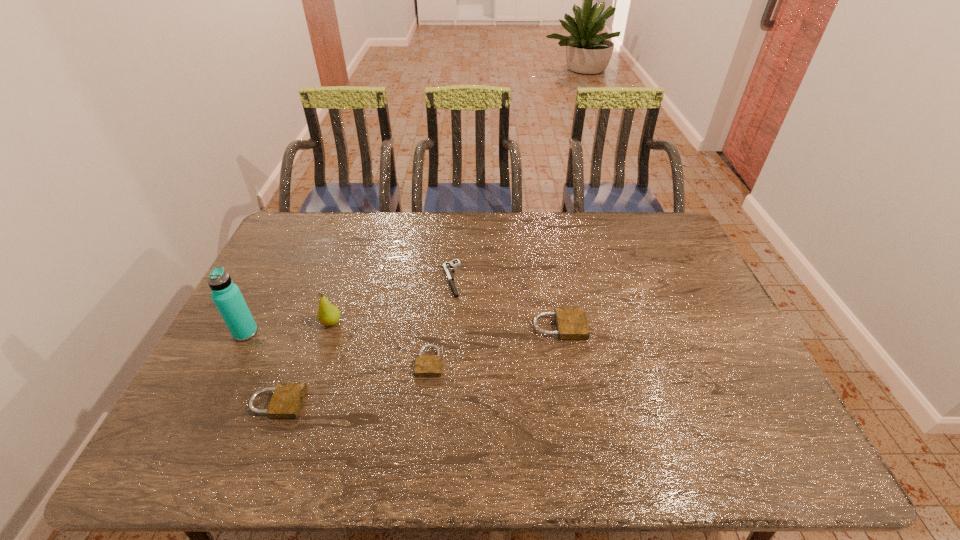
This screenshot has width=960, height=540. What are the coordinates of `free point that keeps the padlocks evenly spaced on the right` in the screenshot? It's located at (671, 296).